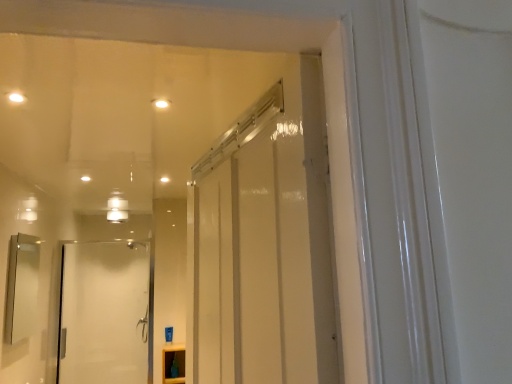
Question: Should I look upward or downward to see white glass door at left?

Choices:
 (A) up
 (B) down

Answer: (B)

Question: From a real-world perspective, is white glass door at left on top of matte white cabinet at lower center?

Choices:
 (A) yes
 (B) no

Answer: (A)

Question: Considering the relative sizes of white glass door at left and matte white cabinet at lower center in the image provided, is white glass door at left shorter than matte white cabinet at lower center?

Choices:
 (A) no
 (B) yes

Answer: (A)

Question: Is white glass door at left taller than matte white cabinet at lower center?

Choices:
 (A) yes
 (B) no

Answer: (A)

Question: Is white glass door at left at the right side of matte white cabinet at lower center?

Choices:
 (A) yes
 (B) no

Answer: (B)

Question: Is white glass door at left in front of matte white cabinet at lower center?

Choices:
 (A) yes
 (B) no

Answer: (B)

Question: Is white glass door at left not near matte white cabinet at lower center?

Choices:
 (A) no
 (B) yes

Answer: (B)

Question: Is matte white cabinet at lower center outside matte silver mirror at left?

Choices:
 (A) no
 (B) yes

Answer: (B)

Question: Is matte white cabinet at lower center bigger than matte silver mirror at left?

Choices:
 (A) yes
 (B) no

Answer: (B)

Question: Is the position of matte white cabinet at lower center more distant than that of matte silver mirror at left?

Choices:
 (A) no
 (B) yes

Answer: (B)

Question: Is matte white cabinet at lower center aimed at matte silver mirror at left?

Choices:
 (A) yes
 (B) no

Answer: (B)

Question: From the image's perspective, is matte white cabinet at lower center below matte silver mirror at left?

Choices:
 (A) yes
 (B) no

Answer: (A)

Question: Does matte white cabinet at lower center appear on the right side of matte silver mirror at left?

Choices:
 (A) no
 (B) yes

Answer: (B)

Question: From a real-world perspective, is matte white cabinet at lower center on white glass door at left?

Choices:
 (A) no
 (B) yes

Answer: (A)